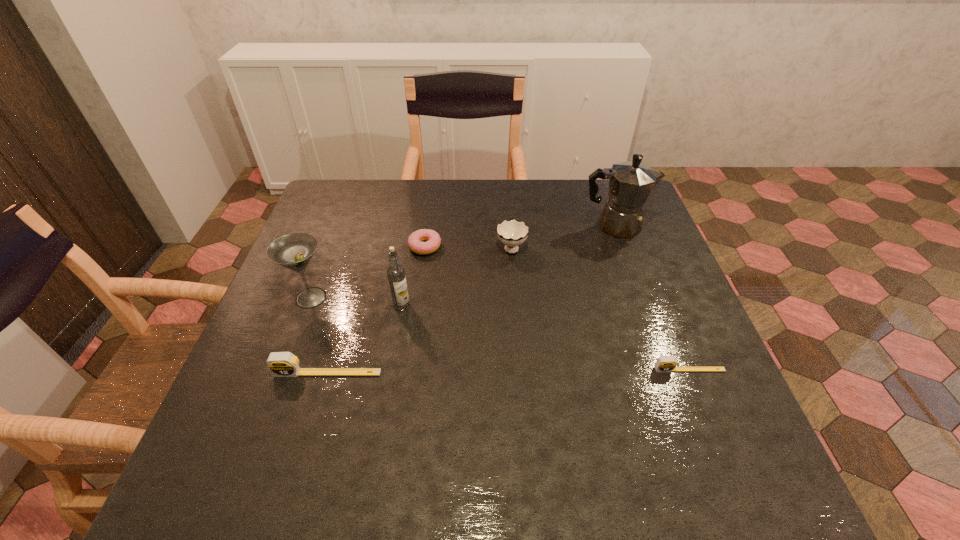
Locate an element on the screen. The height and width of the screenshot is (540, 960). tape measure at the right edge is located at coordinates (664, 363).

The width and height of the screenshot is (960, 540). I want to click on coffeepot located in the right edge section of the desktop, so click(x=630, y=183).

Identify the location of object that is positioned at the far right corner. Image resolution: width=960 pixels, height=540 pixels. (630, 183).

Locate an element on the screen. Image resolution: width=960 pixels, height=540 pixels. free space at the far edge of the desktop is located at coordinates (490, 181).

Where is `vacant position at the left edge of the desktop`? vacant position at the left edge of the desktop is located at coordinates (348, 272).

Find the location of a particular element. free space at the right edge of the desktop is located at coordinates (721, 392).

Find the location of `vacant space at the near left corner`. vacant space at the near left corner is located at coordinates (233, 411).

At what (x,y) coordinates should I click in order to perform the action: click on vacant area at the near right corner. Please return your answer as a coordinate pair (x, y). Image resolution: width=960 pixels, height=540 pixels. Looking at the image, I should click on (671, 424).

Where is `vacant area that lies between the doughnut and the third object from right to left`? vacant area that lies between the doughnut and the third object from right to left is located at coordinates (468, 247).

The width and height of the screenshot is (960, 540). What are the coordinates of `free space between the martini and the shorter tape measure` in the screenshot? It's located at (500, 334).